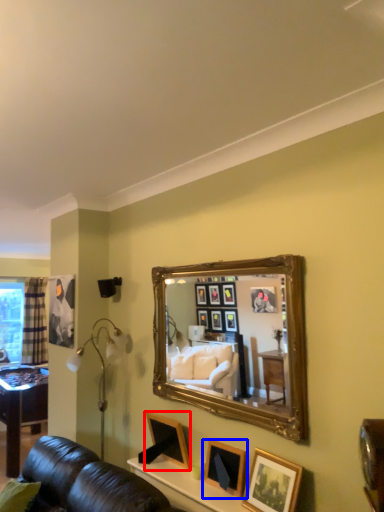
Question: Which point is further to the camera, picture frame (highlighted by a red box) or picture frame (highlighted by a blue box)?

Choices:
 (A) picture frame
 (B) picture frame

Answer: (A)